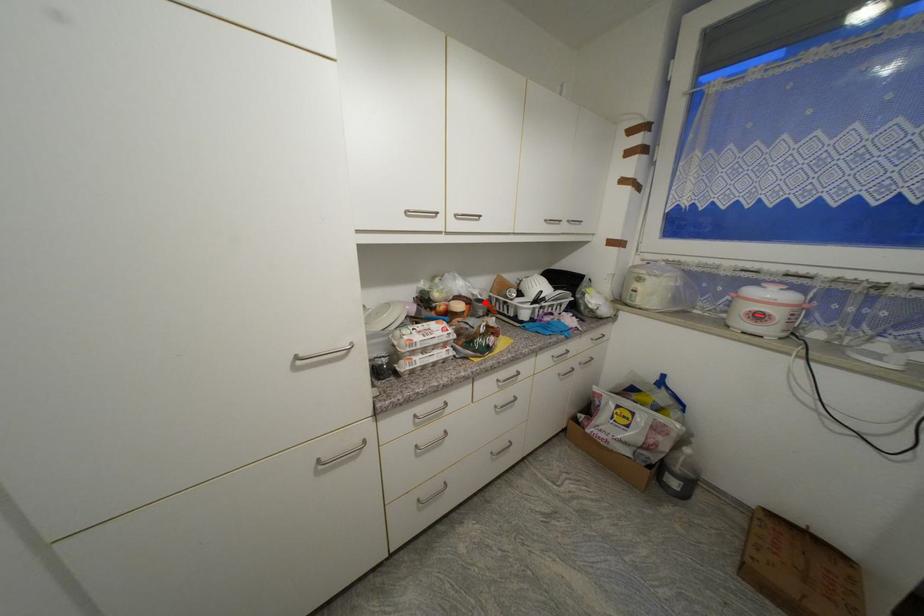
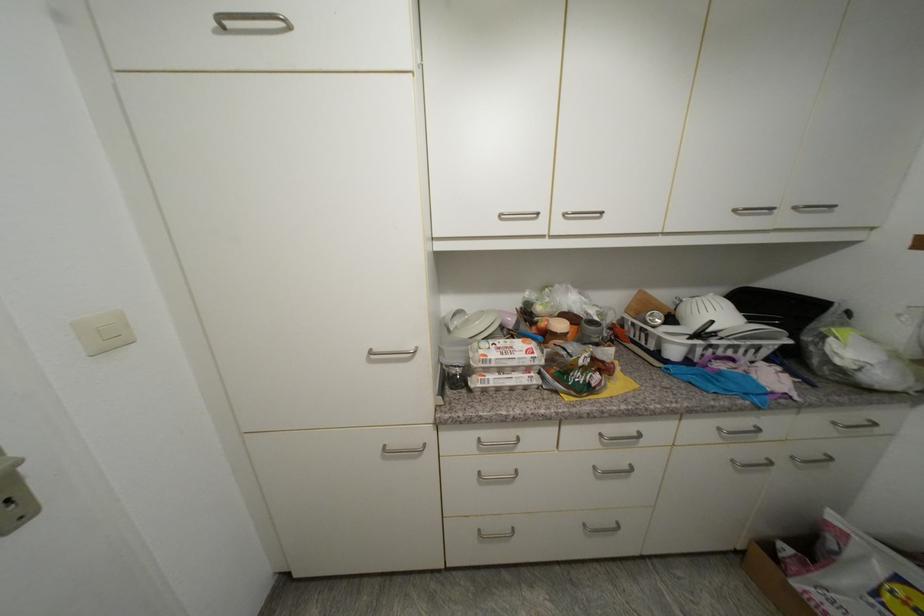
Where in the second image is the point corresponding to the highlighted location from the first image?

(598, 323)